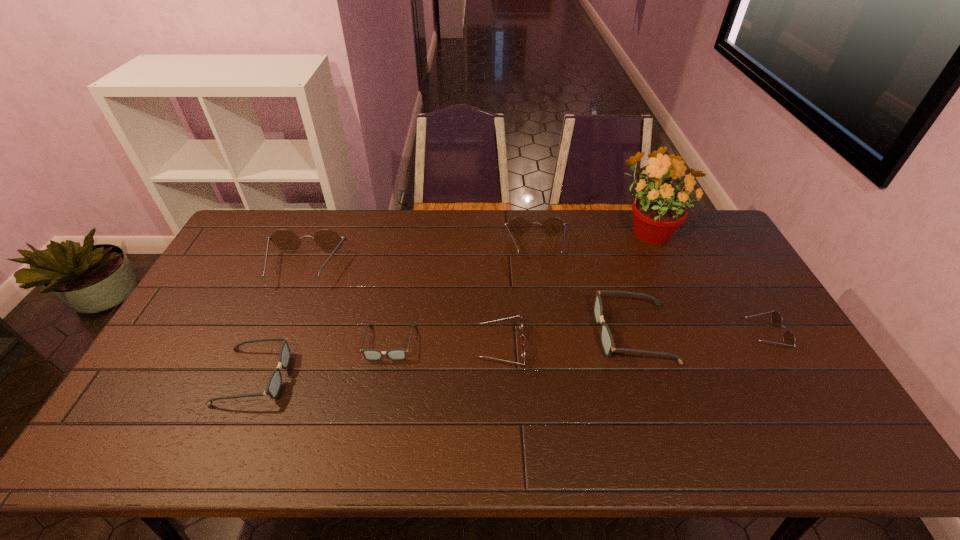
Find the location of a particular element. This screenshot has width=960, height=540. free space located 0.120m on the front-facing side of the third biggest yellow spectacles is located at coordinates (436, 348).

This screenshot has height=540, width=960. Find the location of `free space located on the front-facing side of the third biggest yellow spectacles`. free space located on the front-facing side of the third biggest yellow spectacles is located at coordinates (350, 348).

Where is `free space located on the face of the second smallest gray spectacles`? The image size is (960, 540). free space located on the face of the second smallest gray spectacles is located at coordinates (381, 376).

Find the location of a particular element. vacant space located 0.370m on the front-facing side of the rightmost object is located at coordinates (619, 335).

Identify the location of free space located 0.400m on the front-facing side of the rightmost object. Image resolution: width=960 pixels, height=540 pixels. (x=609, y=335).

Identify the location of vacant space located on the front-facing side of the rightmost object. (675, 335).

Locate an element on the screen. The width and height of the screenshot is (960, 540). vacant area situated 0.080m on the face of the smallest gray spectacles is located at coordinates coord(381,387).

Identify the location of flowerpot that is at the far edge. (658, 210).

This screenshot has height=540, width=960. I want to click on object present at the left edge, so click(x=329, y=240).

You are a GUI agent. You are given a task and a screenshot of the screen. Output one action in this format:
    pyautogui.click(x=<x>, y=<y>)
    Task: Click on the flowerpot that is at the right edge
    The width and height of the screenshot is (960, 540).
    Given the screenshot: What is the action you would take?
    pyautogui.click(x=658, y=210)